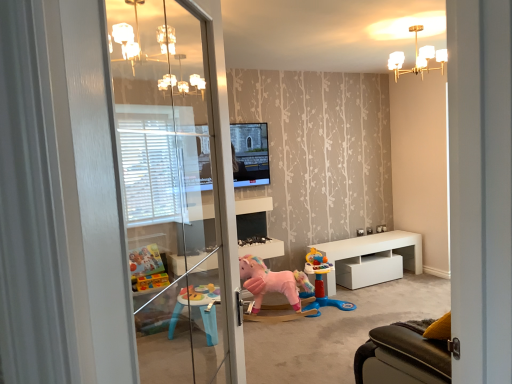
Where is `free space above gold metallic chandelier at upper center (from a real-world perspective)`? free space above gold metallic chandelier at upper center (from a real-world perspective) is located at coordinates (417, 26).